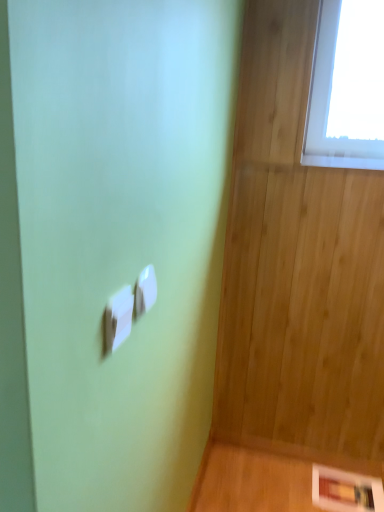
Where is `vacant space situated above white glossy picture frame at lower right (from a real-world perspective)`? The height and width of the screenshot is (512, 384). vacant space situated above white glossy picture frame at lower right (from a real-world perspective) is located at coordinates (342, 484).